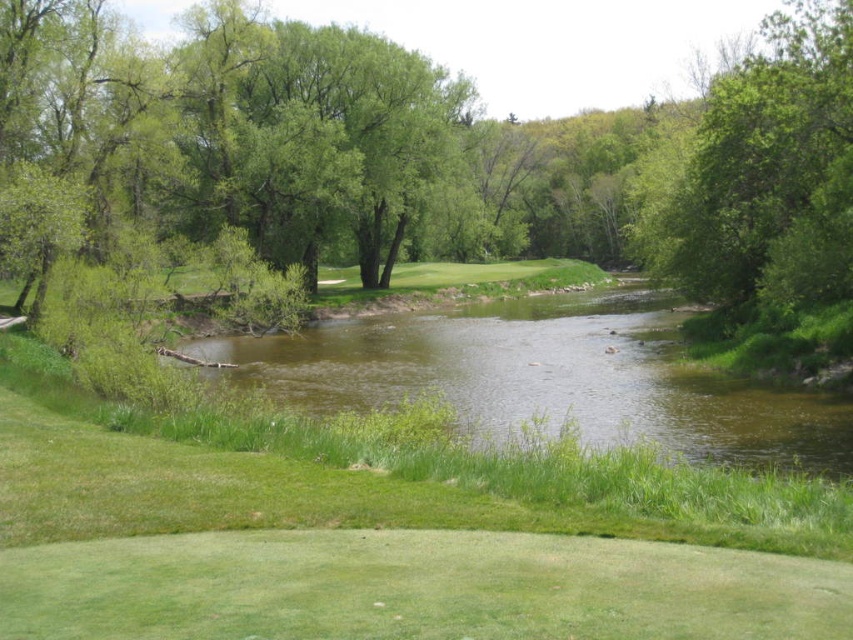
You are a golfer standing on the green grassy golf course at center. You want to hit the ball to the green leafy tree at upper right. Is the tree behind or in front of you?

The green grassy golf course at center is in front of the green leafy tree at upper right, so the tree is behind you.

You are standing at the origin point in the image and want to reach the green grassy golf course at center. According to the coordinates provided, in which direction should you move?

The green grassy golf course at center is located at coordinates point (387,536), so you should move towards the right and slightly forward to reach it.

You are standing at the golf course and see two points marked in the scene. Which point is closer to you, point (x=161, y=524) or point (x=787, y=253)?

Point (x=161, y=524) is in front of point (x=787, y=253), so it is closer to you.